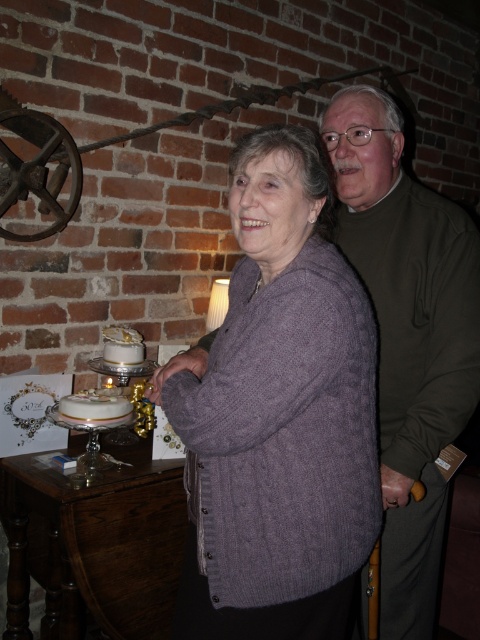
Question: Among these points, which one is nearest to the camera?

Choices:
 (A) (x=384, y=593)
 (B) (x=86, y=403)

Answer: (A)

Question: Is purple knitted sweater at center to the left of white glossy cake at lower left from the viewer's perspective?

Choices:
 (A) no
 (B) yes

Answer: (A)

Question: Which point is closer to the camera?

Choices:
 (A) (105, 397)
 (B) (84, 564)

Answer: (B)

Question: Does green matte sweater at upper right appear on the right side of brown wooden table at lower left?

Choices:
 (A) yes
 (B) no

Answer: (A)

Question: Which object is positioned closest to the white glossy cake at lower left?

Choices:
 (A) purple knitted sweater at center
 (B) white frosted cake at lower left
 (C) brown wooden table at lower left

Answer: (B)

Question: Does purple knitted sweater at center appear under brown wooden table at lower left?

Choices:
 (A) no
 (B) yes

Answer: (A)